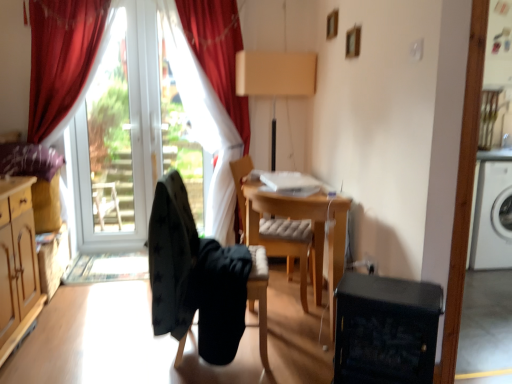
Question: Is velvet red curtain at upper left, the 2th curtain when ordered from left to right, smaller than wooden desk at center?

Choices:
 (A) yes
 (B) no

Answer: (B)

Question: Is velvet red curtain at upper left, which ranks as the 1th curtain in right-to-left order, facing towards wooden desk at center?

Choices:
 (A) no
 (B) yes

Answer: (B)

Question: From a real-world perspective, is velvet red curtain at upper left, which ranks as the 1th curtain in right-to-left order, on wooden desk at center?

Choices:
 (A) no
 (B) yes

Answer: (B)

Question: Considering the relative sizes of velvet red curtain at upper left, which ranks as the 1th curtain in right-to-left order, and wooden desk at center in the image provided, is velvet red curtain at upper left, which ranks as the 1th curtain in right-to-left order, taller than wooden desk at center?

Choices:
 (A) yes
 (B) no

Answer: (A)

Question: Can you confirm if velvet red curtain at upper left, which ranks as the 1th curtain in right-to-left order, is wider than wooden desk at center?

Choices:
 (A) yes
 (B) no

Answer: (B)

Question: From a real-world perspective, is wooden cushioned chair at center, which is the 1th chair in back-to-front order, physically located above or below red velvet curtain at left, placed as the 2th curtain when sorted from right to left?

Choices:
 (A) above
 (B) below

Answer: (B)

Question: From their relative heights in the image, would you say wooden cushioned chair at center, which is the 1th chair in back-to-front order, is taller or shorter than red velvet curtain at left, which is the first curtain from left to right?

Choices:
 (A) short
 (B) tall

Answer: (A)

Question: Is point (286, 236) closer or farther from the camera than point (179, 36)?

Choices:
 (A) closer
 (B) farther

Answer: (A)

Question: Visually, is wooden cushioned chair at center, the second chair from the front, positioned to the left or to the right of red velvet curtain at left, placed as the 2th curtain when sorted from right to left?

Choices:
 (A) right
 (B) left

Answer: (A)

Question: In the image, is velvet red curtain at upper left, the 2th curtain when ordered from left to right, on the left side or the right side of wooden cushioned chair at center, which is the 1th chair in back-to-front order?

Choices:
 (A) right
 (B) left

Answer: (B)

Question: From the image's perspective, relative to wooden cushioned chair at center, which is the 1th chair in back-to-front order, is velvet red curtain at upper left, which ranks as the 1th curtain in right-to-left order, above or below?

Choices:
 (A) below
 (B) above

Answer: (B)

Question: Is velvet red curtain at upper left, the 2th curtain when ordered from left to right, situated inside wooden cushioned chair at center, which is the 1th chair in back-to-front order, or outside?

Choices:
 (A) inside
 (B) outside

Answer: (B)

Question: Is velvet red curtain at upper left, the 2th curtain when ordered from left to right, wider or thinner than wooden cushioned chair at center, which is the 1th chair in back-to-front order?

Choices:
 (A) wide
 (B) thin

Answer: (B)

Question: From a real-world perspective, is red velvet curtain at left, placed as the 2th curtain when sorted from right to left, positioned above or below black plastic dishwasher at lower right?

Choices:
 (A) below
 (B) above

Answer: (B)

Question: Based on their sizes in the image, would you say red velvet curtain at left, which is the first curtain from left to right, is bigger or smaller than black plastic dishwasher at lower right?

Choices:
 (A) small
 (B) big

Answer: (B)